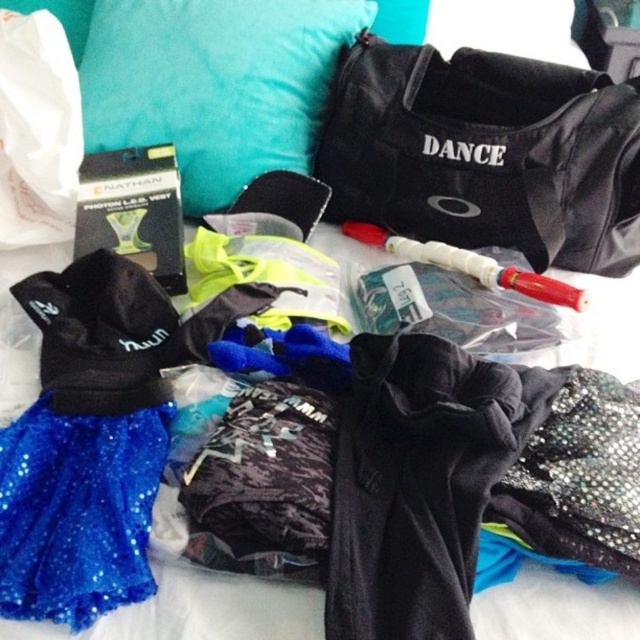
Consider the image. Between black fabric duffel at upper right and sparkly blue skirt at lower left, which one is positioned higher?

black fabric duffel at upper right is above.

The image size is (640, 640). Describe the element at coordinates (484, 154) in the screenshot. I see `black fabric duffel at upper right` at that location.

Is point (528, 58) farther from viewer compared to point (19, 552)?

Yes, it is behind point (19, 552).

Find the location of `black fabric duffel at upper right`. black fabric duffel at upper right is located at coordinates (484, 154).

Is teal fabric pillow at upper left positioned at the back of sparkly blue skirt at lower left?

Yes.

Who is positioned more to the left, teal fabric pillow at upper left or sparkly blue skirt at lower left?

From the viewer's perspective, sparkly blue skirt at lower left appears more on the left side.

The image size is (640, 640). In order to click on teal fabric pillow at upper left in this screenshot , I will do `click(214, 83)`.

Is black fabric duffel at upper right above teal fabric pillow at upper left?

No, black fabric duffel at upper right is not above teal fabric pillow at upper left.

Is point (445, 177) behind point (234, 102)?

No, it is not.

Where is `black fabric duffel at upper right`? Image resolution: width=640 pixels, height=640 pixels. black fabric duffel at upper right is located at coordinates click(x=484, y=154).